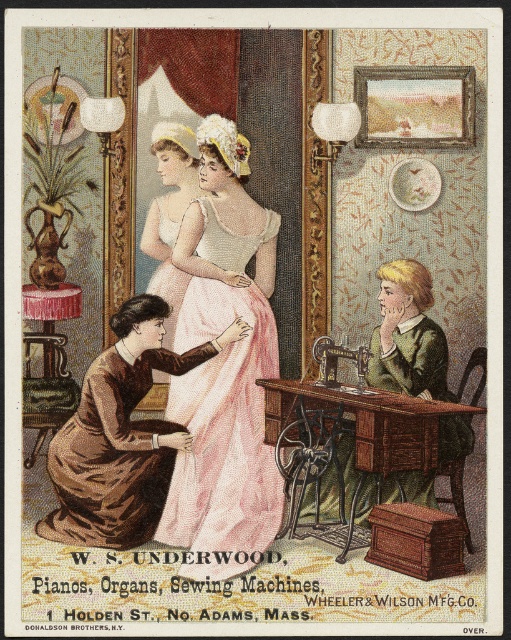
You are a tailor in the Victorian era who needs to measure the distance between the pink satin dress at center and the matte white dress at center to ensure proper fabric allocation. Given that the minimum required distance for accurate measurement is 30 inches, will you be able to proceed with the current spacing?

The pink satin dress at center and matte white dress at center are 29.63 inches apart, which is less than the required 30 inches. Therefore, the tailor cannot proceed with the current spacing and needs to adjust the dresses to meet the minimum distance requirement.

You are a tailor working in the Victorian era and need to adjust the hem of the matte white dress at center. The metallic silver sewing machine at center is your only tool. Can you move the dress to the sewing machine without needing to step outside the room?

The matte white dress at center is 1.15 meters away from the metallic silver sewing machine at center. Since the distance is manageable within the room, you can easily move the dress to the sewing machine without needing to step outside.